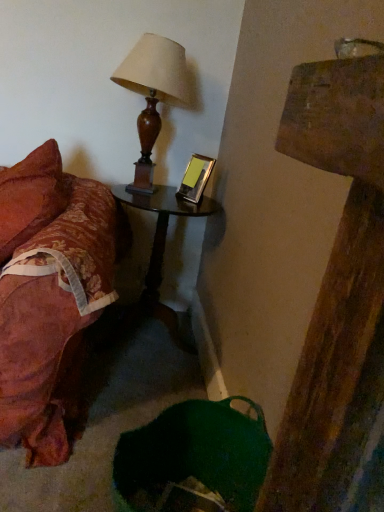
Question: From the image's perspective, would you say black glossy nightstand at center is positioned over metallic silver picture frame at upper right?

Choices:
 (A) yes
 (B) no

Answer: (B)

Question: Is black glossy nightstand at center not within metallic silver picture frame at upper right?

Choices:
 (A) no
 (B) yes

Answer: (B)

Question: Are black glossy nightstand at center and metallic silver picture frame at upper right beside each other?

Choices:
 (A) no
 (B) yes

Answer: (A)

Question: From the image's perspective, is black glossy nightstand at center beneath metallic silver picture frame at upper right?

Choices:
 (A) no
 (B) yes

Answer: (B)

Question: Is black glossy nightstand at center aimed at metallic silver picture frame at upper right?

Choices:
 (A) yes
 (B) no

Answer: (B)

Question: Based on their sizes in the image, would you say metallic silver picture frame at upper right is bigger or smaller than wooden lampshade at upper left?

Choices:
 (A) small
 (B) big

Answer: (A)

Question: From a real-world perspective, relative to wooden lampshade at upper left, is metallic silver picture frame at upper right vertically above or below?

Choices:
 (A) above
 (B) below

Answer: (B)

Question: In terms of height, does metallic silver picture frame at upper right look taller or shorter compared to wooden lampshade at upper left?

Choices:
 (A) tall
 (B) short

Answer: (B)

Question: In the image, is metallic silver picture frame at upper right positioned in front of or behind wooden lampshade at upper left?

Choices:
 (A) behind
 (B) front

Answer: (A)

Question: Does point (x=155, y=52) appear closer or farther from the camera than point (x=130, y=200)?

Choices:
 (A) farther
 (B) closer

Answer: (B)

Question: From the image's perspective, is wooden lampshade at upper left located above or below black glossy nightstand at center?

Choices:
 (A) above
 (B) below

Answer: (A)

Question: From their relative heights in the image, would you say wooden lampshade at upper left is taller or shorter than black glossy nightstand at center?

Choices:
 (A) tall
 (B) short

Answer: (B)

Question: Looking at the image, does wooden lampshade at upper left seem bigger or smaller compared to black glossy nightstand at center?

Choices:
 (A) small
 (B) big

Answer: (A)

Question: Visually, is black glossy nightstand at center positioned to the left or to the right of metallic silver picture frame at upper right?

Choices:
 (A) right
 (B) left

Answer: (B)

Question: From a real-world perspective, is black glossy nightstand at center positioned above or below metallic silver picture frame at upper right?

Choices:
 (A) below
 (B) above

Answer: (A)